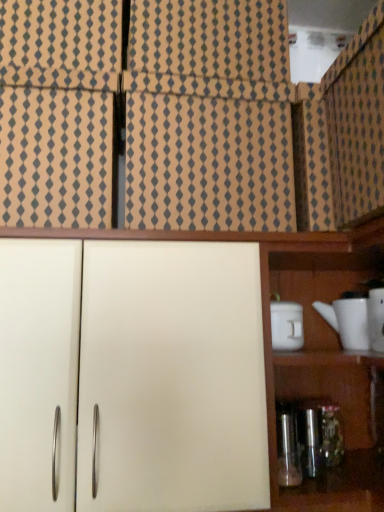
Question: Relative to white matte container at right, is metallic glass bottle at lower right in front or behind?

Choices:
 (A) behind
 (B) front

Answer: (B)

Question: Is point (292, 434) positioned closer to the camera than point (278, 335)?

Choices:
 (A) farther
 (B) closer

Answer: (B)

Question: Based on their relative distances, which object is nearer to the white matte cabinet at center, marked as the first cabinetry in a bottom-to-top arrangement?

Choices:
 (A) white glossy teapot at right
 (B) white matte container at right
 (C) patterned cardboard at upper left, which is counted as the second cabinetry, starting from the bottom
 (D) beige textured tile at upper center
 (E) metallic glass bottle at lower right

Answer: (D)

Question: Based on their relative distances, which object is nearer to the white matte cabinet at center, marked as the first cabinetry in a bottom-to-top arrangement?

Choices:
 (A) metallic glass bottle at lower right
 (B) patterned cardboard at upper left, which is counted as the second cabinetry, starting from the bottom
 (C) white glossy teapot at right
 (D) beige textured tile at upper center
 (E) white matte container at right

Answer: (D)